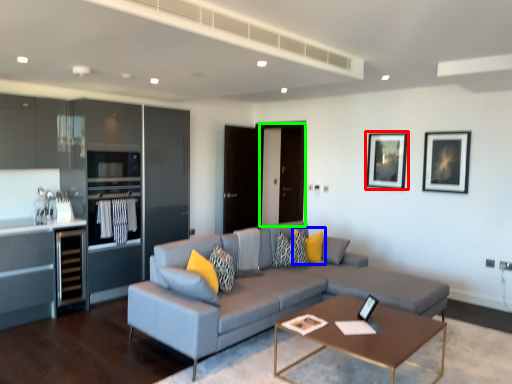
Question: Based on their relative distances, which object is nearer to picture frame (highlighted by a red box)? Choose from pillow (highlighted by a blue box) and glass door (highlighted by a green box).

Choices:
 (A) pillow
 (B) glass door

Answer: (B)